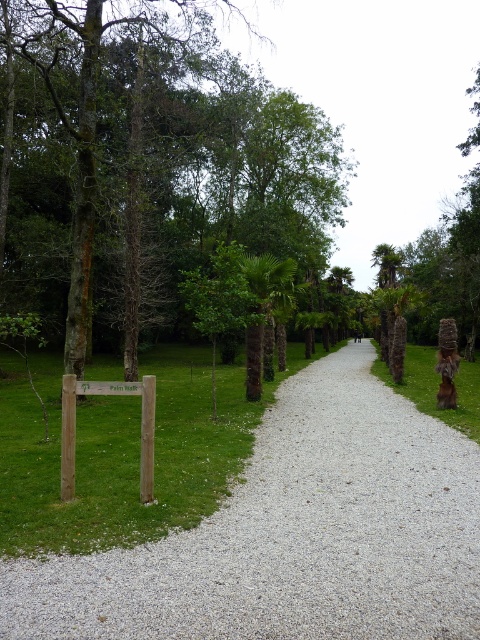
Question: Estimate the real-world distances between objects in this image. Which object is closer to the gray gravel at center?

Choices:
 (A) wooden signpost at center
 (B) green grass at right

Answer: (A)

Question: Can you confirm if gray gravel at center is thinner than wooden signpost at center?

Choices:
 (A) yes
 (B) no

Answer: (B)

Question: Does green grass at right lie behind wooden signpost at center?

Choices:
 (A) no
 (B) yes

Answer: (B)

Question: Does green grass at right come in front of wooden signpost at center?

Choices:
 (A) no
 (B) yes

Answer: (A)

Question: Which point appears farthest from the camera in this image?

Choices:
 (A) (377, 356)
 (B) (204, 636)
 (C) (67, 412)

Answer: (A)

Question: Which point appears closest to the camera in this image?

Choices:
 (A) (423, 352)
 (B) (197, 531)

Answer: (B)